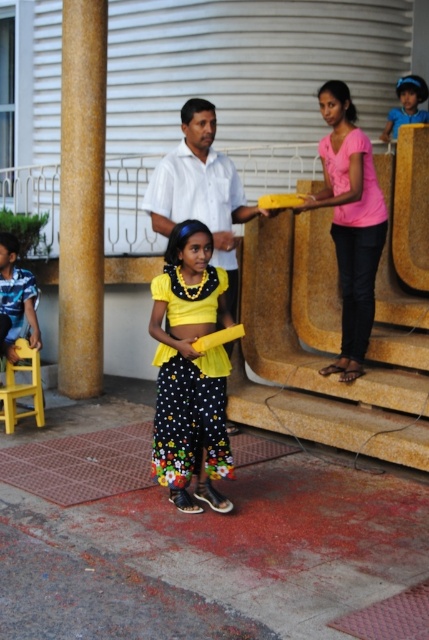
Question: Where is yellow fabric dress at center located in relation to black leather sandal at lower center in the image?

Choices:
 (A) above
 (B) below

Answer: (A)

Question: Can you confirm if pink matte shirt at upper center is positioned above brown leather sandal at lower center?

Choices:
 (A) yes
 (B) no

Answer: (A)

Question: Can you confirm if pink matte shirt at upper center is wider than black leather sandal at lower center?

Choices:
 (A) yes
 (B) no

Answer: (A)

Question: Which object appears closest to the camera in this image?

Choices:
 (A) black leather sandal at lower center
 (B) yellow plastic chair at lower left
 (C) yellow fabric shirt at left
 (D) yellow fabric dress at center

Answer: (D)

Question: Which point is farther to the camera?

Choices:
 (A) golden textured pillar at left
 (B) yellow fabric dress at center
 (C) yellow plastic chair at lower left
 (D) blue fabric hat at upper right

Answer: (D)

Question: Which is nearer to the brown leather sandal at lower center?

Choices:
 (A) black leather sandal at lower center
 (B) golden textured pillar at left

Answer: (A)